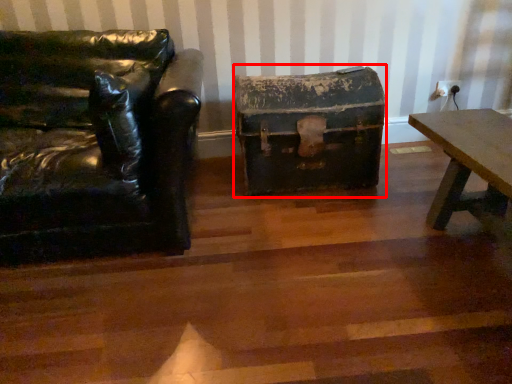
Question: From the image's perspective, what is the correct spatial relationship of box (annotated by the red box) in relation to chair?

Choices:
 (A) above
 (B) below

Answer: (A)